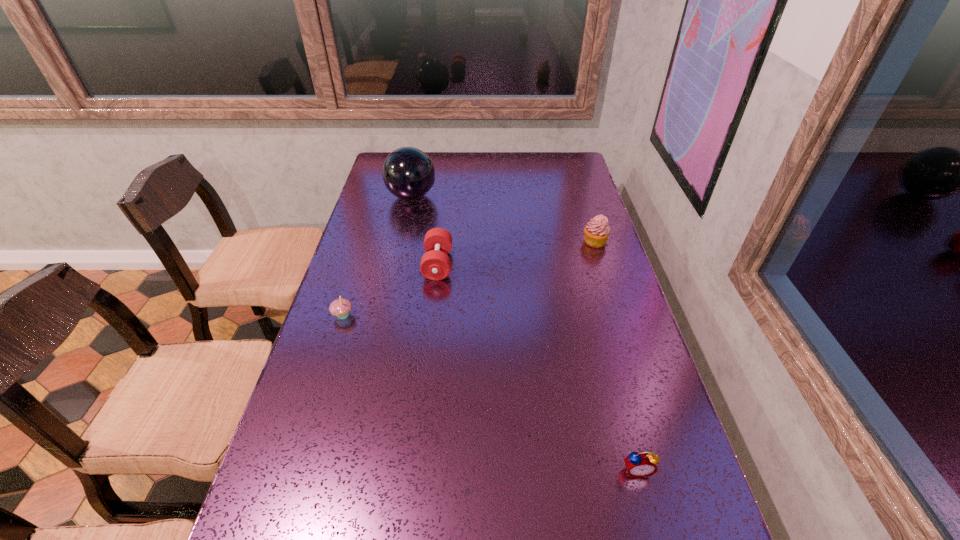
What are the coordinates of `the tallest object` in the screenshot? It's located at (408, 173).

Where is `the farthest object`? This screenshot has width=960, height=540. the farthest object is located at coordinates click(x=408, y=173).

Where is `the taller cupcake`? the taller cupcake is located at coordinates (597, 231).

You are a GUI agent. You are given a task and a screenshot of the screen. Output one action in this format:
    pyautogui.click(x=<x>, y=<y>)
    Task: Click on the right cupcake
    This screenshot has width=960, height=540.
    Given the screenshot: What is the action you would take?
    pyautogui.click(x=597, y=231)

Locate an element on the screen. dumbbell is located at coordinates (435, 264).

Find the location of a particular element. The image size is (960, 540). the shorter cupcake is located at coordinates (341, 307).

Where is `the nearer cupcake`? The width and height of the screenshot is (960, 540). the nearer cupcake is located at coordinates [341, 307].

This screenshot has width=960, height=540. I want to click on the nearest object, so click(641, 464).

This screenshot has height=540, width=960. I want to click on vacant space located 0.120m on the side of the farthest object with the finger holes, so click(468, 196).

Image resolution: width=960 pixels, height=540 pixels. Find the location of `free space located 0.390m on the front of the right cupcake`. free space located 0.390m on the front of the right cupcake is located at coordinates (627, 344).